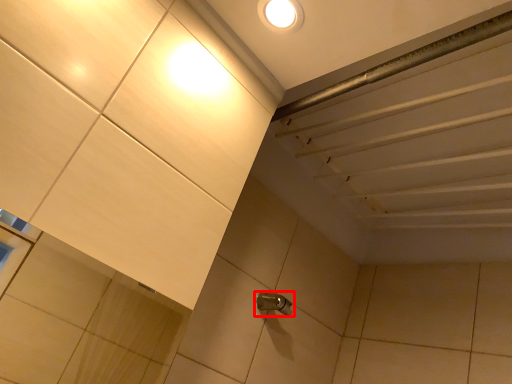
Question: From the image's perspective, where is plumbing fixture (annotated by the red box) located relative to droplight?

Choices:
 (A) above
 (B) below

Answer: (B)